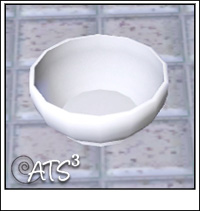
The height and width of the screenshot is (211, 200). I want to click on inside of bowl, so click(114, 94).